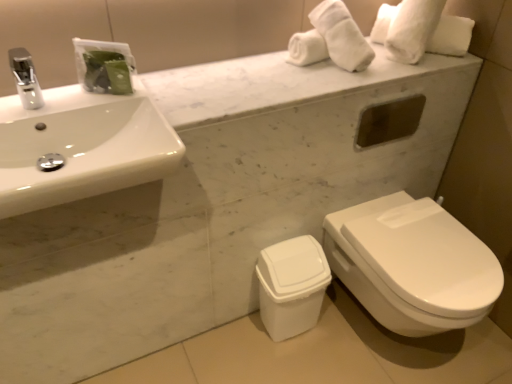
The height and width of the screenshot is (384, 512). Describe the element at coordinates (83, 136) in the screenshot. I see `white glossy sink at upper left` at that location.

This screenshot has height=384, width=512. What are the coordinates of `white glossy sink at upper left` in the screenshot? It's located at (83, 136).

What is the approximate width of silver metallic faucet at upper left?

silver metallic faucet at upper left is 5.82 inches in width.

At what (x,y) coordinates should I click in order to perform the action: click on white glossy toilet at lower right. Please return your answer as a coordinate pair (x, y). This screenshot has width=512, height=384. Looking at the image, I should click on (412, 265).

Image resolution: width=512 pixels, height=384 pixels. Find the location of `white glossy sink at upper left`. white glossy sink at upper left is located at coordinates (83, 136).

From the image's perspective, is white glossy sink at upper left located beneath white glossy toilet at lower right?

No, from the image's perspective, white glossy sink at upper left is not below white glossy toilet at lower right.

Looking at this image, how distant is white glossy sink at upper left from white glossy toilet at lower right?

white glossy sink at upper left and white glossy toilet at lower right are 33.18 inches apart.

In the scene shown: From a real-world perspective, is white glossy sink at upper left located beneath white glossy toilet at lower right?

No, from a real-world perspective, white glossy sink at upper left is not beneath white glossy toilet at lower right.

Considering their positions, is white glossy sink at upper left located in front of or behind white glossy toilet at lower right?

Clearly, white glossy sink at upper left is in front of white glossy toilet at lower right.

I want to click on sink located above the white plastic trash can at lower center (from the image's perspective), so click(x=83, y=136).

Are white glossy sink at upper left and white plastic trash can at lower center beside each other?

They are not placed beside each other.

Based on the photo, relative to white plastic trash can at lower center, is white glossy sink at upper left in front or behind?

Visually, white glossy sink at upper left is located in front of white plastic trash can at lower center.

Is white glossy sink at upper left looking in the opposite direction of silver metallic faucet at upper left?

white glossy sink at upper left is not turned away from silver metallic faucet at upper left.

Is white glossy sink at upper left surrounding silver metallic faucet at upper left?

No.

From a real-world perspective, is white glossy sink at upper left under silver metallic faucet at upper left?

Indeed, from a real-world perspective, white glossy sink at upper left is positioned beneath silver metallic faucet at upper left.

Based on the photo, is white glossy toilet at lower right not inside silver metallic faucet at upper left?

white glossy toilet at lower right lies outside silver metallic faucet at upper left's area.

Consider the image. Is the depth of white glossy toilet at lower right less than that of silver metallic faucet at upper left?

No, the depth of white glossy toilet at lower right is greater than that of silver metallic faucet at upper left.

From the image's perspective, which object appears higher, white glossy toilet at lower right or silver metallic faucet at upper left?

silver metallic faucet at upper left, from the image's perspective.

Which of these two, white glossy toilet at lower right or silver metallic faucet at upper left, is thinner?

Thinner between the two is silver metallic faucet at upper left.

Considering the points (471, 305) and (47, 94), which point is behind, point (471, 305) or point (47, 94)?

The point (471, 305) is more distant.

Which of these two, white glossy toilet at lower right or white glossy sink at upper left, stands taller?

white glossy toilet at lower right is taller.

Looking at their sizes, would you say white glossy toilet at lower right is wider or thinner than white glossy sink at upper left?

Clearly, white glossy toilet at lower right has more width compared to white glossy sink at upper left.

Is point (395, 235) closer or farther from the camera than point (302, 312)?

Point (395, 235).

From a real-world perspective, is white glossy toilet at lower right on white plastic trash can at lower center?

Correct, in the physical world, white glossy toilet at lower right is higher than white plastic trash can at lower center.

Which is in front, white glossy toilet at lower right or white plastic trash can at lower center?

white glossy toilet at lower right.

Can you confirm if white glossy toilet at lower right is bigger than white plastic trash can at lower center?

Correct, white glossy toilet at lower right is larger in size than white plastic trash can at lower center.

From the image's perspective, is silver metallic faucet at upper left on top of white glossy toilet at lower right?

Yes, from the image's perspective, silver metallic faucet at upper left is above white glossy toilet at lower right.

From the picture: Does silver metallic faucet at upper left have a larger size compared to white glossy toilet at lower right?

Actually, silver metallic faucet at upper left might be smaller than white glossy toilet at lower right.

Which object is positioned more to the right, silver metallic faucet at upper left or white glossy toilet at lower right?

white glossy toilet at lower right.

Where is `toilet that is behind the white glossy sink at upper left`? This screenshot has height=384, width=512. toilet that is behind the white glossy sink at upper left is located at coordinates (412, 265).

Image resolution: width=512 pixels, height=384 pixels. I want to click on sink that appears above the white plastic trash can at lower center (from the image's perspective), so click(83, 136).

Consider the image. Considering their positions, is white glossy sink at upper left positioned closer to silver metallic faucet at upper left than white glossy toilet at lower right?

white glossy sink at upper left lies closer to silver metallic faucet at upper left than the other object.

Looking at this image, based on their spatial positions, is white glossy sink at upper left or white plastic trash can at lower center closer to silver metallic faucet at upper left?

white glossy sink at upper left.

In the scene shown: Estimate the real-world distances between objects in this image. Which object is closer to white glossy toilet at lower right, white plastic trash can at lower center or silver metallic faucet at upper left?

Among the two, white plastic trash can at lower center is located nearer to white glossy toilet at lower right.

Estimate the real-world distances between objects in this image. Which object is closer to white plastic trash can at lower center, silver metallic faucet at upper left or white glossy sink at upper left?

The object closer to white plastic trash can at lower center is white glossy sink at upper left.

Estimate the real-world distances between objects in this image. Which object is closer to white glossy toilet at lower right, white glossy sink at upper left or silver metallic faucet at upper left?

white glossy sink at upper left is positioned closer to the anchor white glossy toilet at lower right.

Based on their spatial positions, is silver metallic faucet at upper left or white glossy toilet at lower right further from white plastic trash can at lower center?

silver metallic faucet at upper left is positioned further to the anchor white plastic trash can at lower center.

Estimate the real-world distances between objects in this image. Which object is closer to white plastic trash can at lower center, white glossy toilet at lower right or silver metallic faucet at upper left?

white glossy toilet at lower right is positioned closer to the anchor white plastic trash can at lower center.

Which object lies nearer to the anchor point white glossy sink at upper left, white glossy toilet at lower right or white plastic trash can at lower center?

white plastic trash can at lower center is positioned closer to the anchor white glossy sink at upper left.

Identify the location of porcelain between white glossy sink at upper left and white glossy toilet at lower right from left to right. (292, 286).

What are the coordinates of `sink between silver metallic faucet at upper left and white plastic trash can at lower center from left to right` in the screenshot? It's located at (83, 136).

Locate an element on the screen. The width and height of the screenshot is (512, 384). sink between silver metallic faucet at upper left and white glossy toilet at lower right from left to right is located at coordinates (83, 136).

Where is `porcelain between silver metallic faucet at upper left and white glossy toilet at lower right from left to right`? This screenshot has width=512, height=384. porcelain between silver metallic faucet at upper left and white glossy toilet at lower right from left to right is located at coordinates (292, 286).